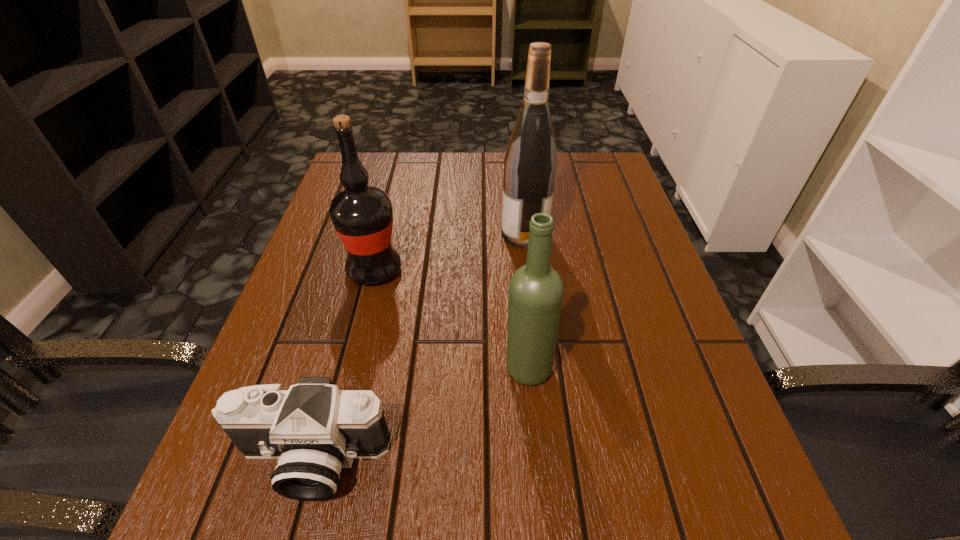
Locate an element on the screen. This screenshot has height=540, width=960. vacant space located 0.350m on the back of the nearest object is located at coordinates (364, 269).

Locate an element on the screen. This screenshot has height=540, width=960. object that is positioned at the near edge is located at coordinates (314, 429).

You are a GUI agent. You are given a task and a screenshot of the screen. Output one action in this format:
    pyautogui.click(x=<x>, y=<y>)
    Task: Click on the wine bottle situated at the left edge
    The image size is (960, 540).
    Given the screenshot: What is the action you would take?
    pyautogui.click(x=362, y=215)

At what (x,y) coordinates should I click in order to perform the action: click on camera present at the left edge. Please return your answer as a coordinate pair (x, y). This screenshot has width=960, height=540. Looking at the image, I should click on (314, 429).

Where is `object that is at the near left corner`? This screenshot has height=540, width=960. object that is at the near left corner is located at coordinates (314, 429).

Image resolution: width=960 pixels, height=540 pixels. What are the coordinates of `vacant area at the far edge` in the screenshot? It's located at click(424, 166).

The height and width of the screenshot is (540, 960). In order to click on vacant space at the left edge in this screenshot , I will do `click(326, 295)`.

Locate an element on the screen. Image resolution: width=960 pixels, height=540 pixels. free region at the right edge of the desktop is located at coordinates point(611,226).

Identify the location of vacant region at the far left corner of the desktop. This screenshot has width=960, height=540. (364, 153).

Identify the location of free point at the far right corner. The width and height of the screenshot is (960, 540). point(565,158).